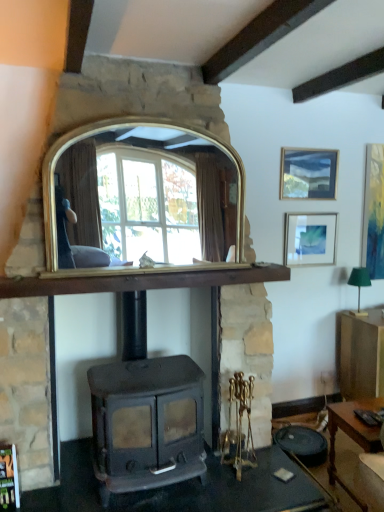
Identify the location of matte gold picture frame at right, the third picture frame when ordered from left to right. The height and width of the screenshot is (512, 384). (374, 212).

The height and width of the screenshot is (512, 384). What are the coordinates of `matte silver picture frame at upper right, which is the 2th picture frame in left-to-right order` in the screenshot? It's located at (310, 239).

This screenshot has width=384, height=512. What do you see at coordinates (359, 286) in the screenshot?
I see `green fabric lampshade at right` at bounding box center [359, 286].

Identify the location of matte wooden picture frame at upper right, placed as the first picture frame when sorted from left to right. (308, 173).

Image resolution: width=384 pixels, height=512 pixels. What do you see at coordinates (351, 435) in the screenshot? I see `wooden desk at lower right` at bounding box center [351, 435].

Based on the photo, in order to face wooden mantel at center, should I rotate leftwards or rightwards?

Turn left by 6.406 degrees to look at wooden mantel at center.

Measure the distance between wooden mantel at center and camera.

2.03 meters.

Where is `matte gold picture frame at right, arranged as the 1th picture frame when viewed from the right`? The height and width of the screenshot is (512, 384). matte gold picture frame at right, arranged as the 1th picture frame when viewed from the right is located at coordinates (374, 212).

You are a GUI agent. You are given a task and a screenshot of the screen. Output one action in this format:
    pyautogui.click(x=<x>, y=<y>)
    Task: Click on the 2nd picture frame behind the gold/glass mirror at center, starting your count from the anchor
    
    Given the screenshot: What is the action you would take?
    pyautogui.click(x=310, y=239)

In terms of width, does gold/glass mirror at center look wider or thinner when compared to matte silver picture frame at upper right, which is the 2th picture frame in left-to-right order?

gold/glass mirror at center is wider than matte silver picture frame at upper right, which is the 2th picture frame in left-to-right order.

Is gold/glass mirror at center placed right next to matte silver picture frame at upper right, which is the 2th picture frame in left-to-right order?

No, gold/glass mirror at center is not next to matte silver picture frame at upper right, which is the 2th picture frame in left-to-right order.

Can you confirm if gold/glass mirror at center is taller than matte silver picture frame at upper right, arranged as the second picture frame when viewed from the right?

Indeed, gold/glass mirror at center has a greater height compared to matte silver picture frame at upper right, arranged as the second picture frame when viewed from the right.

Is matte black wood burning stove at center thinner than wooden desk at lower right?

In fact, matte black wood burning stove at center might be wider than wooden desk at lower right.

Does matte black wood burning stove at center touch wooden desk at lower right?

matte black wood burning stove at center and wooden desk at lower right are clearly separated.

I want to click on desk behind the matte black wood burning stove at center, so click(x=351, y=435).

Choose the correct answer: Is matte black wood burning stove at center inside wooden desk at lower right or outside it?

matte black wood burning stove at center is not enclosed by wooden desk at lower right.

Which is behind, matte black wood burning stove at center or wooden mantel at center?

wooden mantel at center.

How much distance is there between matte black wood burning stove at center and wooden mantel at center?

A distance of 23.73 inches exists between matte black wood burning stove at center and wooden mantel at center.

Can you see matte black wood burning stove at center touching wooden mantel at center?

matte black wood burning stove at center and wooden mantel at center are clearly separated.

Between green fabric lampshade at right and matte silver picture frame at upper right, which is the 2th picture frame in left-to-right order, which one appears on the right side from the viewer's perspective?

From the viewer's perspective, green fabric lampshade at right appears more on the right side.

In terms of width, does green fabric lampshade at right look wider or thinner when compared to matte silver picture frame at upper right, which is the 2th picture frame in left-to-right order?

In the image, green fabric lampshade at right appears to be wider than matte silver picture frame at upper right, which is the 2th picture frame in left-to-right order.

How different are the orientations of green fabric lampshade at right and matte silver picture frame at upper right, arranged as the second picture frame when viewed from the right, in degrees?

0.91 degrees separate the facing orientations of green fabric lampshade at right and matte silver picture frame at upper right, arranged as the second picture frame when viewed from the right.

Is point (357, 311) less distant than point (302, 236)?

No, it is behind (302, 236).

Is wooden mantel at center wider than matte wooden picture frame at upper right, which appears as the third picture frame when viewed from the right?

Correct, the width of wooden mantel at center exceeds that of matte wooden picture frame at upper right, which appears as the third picture frame when viewed from the right.

Is wooden mantel at center not inside matte wooden picture frame at upper right, which appears as the third picture frame when viewed from the right?

Yes, wooden mantel at center is outside of matte wooden picture frame at upper right, which appears as the third picture frame when viewed from the right.

From a real-world perspective, is wooden mantel at center below matte wooden picture frame at upper right, which appears as the third picture frame when viewed from the right?

Indeed, from a real-world perspective, wooden mantel at center is positioned beneath matte wooden picture frame at upper right, which appears as the third picture frame when viewed from the right.

Is wooden mantel at center oriented towards gold/glass mirror at center?

No, wooden mantel at center is not oriented towards gold/glass mirror at center.

In the scene shown: How different are the orientations of wooden mantel at center and gold/glass mirror at center in degrees?

The angle between the facing direction of wooden mantel at center and the facing direction of gold/glass mirror at center is 0.764 degrees.

Between wooden mantel at center and gold/glass mirror at center, which one is positioned in front?

wooden mantel at center.

From the image's perspective, which one is positioned higher, wooden mantel at center or gold/glass mirror at center?

gold/glass mirror at center is shown above in the image.

Who is bigger, matte wooden picture frame at upper right, which appears as the third picture frame when viewed from the right, or matte black wood burning stove at center?

matte black wood burning stove at center.

Considering the sizes of objects matte wooden picture frame at upper right, placed as the first picture frame when sorted from left to right, and matte black wood burning stove at center in the image provided, who is taller, matte wooden picture frame at upper right, placed as the first picture frame when sorted from left to right, or matte black wood burning stove at center?

matte black wood burning stove at center is taller.

From the image's perspective, is matte wooden picture frame at upper right, placed as the first picture frame when sorted from left to right, located above or below matte black wood burning stove at center?

Clearly, from the image's perspective, matte wooden picture frame at upper right, placed as the first picture frame when sorted from left to right, is above matte black wood burning stove at center.

The width and height of the screenshot is (384, 512). What are the coordinates of `picture frame that is the 2nd object located behind the gold/glass mirror at center` in the screenshot? It's located at (310, 239).

Find the location of a particular element. The width and height of the screenshot is (384, 512). desk that is on the right side of matte black wood burning stove at center is located at coordinates (351, 435).

Based on their spatial positions, is matte wooden picture frame at upper right, which appears as the third picture frame when viewed from the right, or gold/glass mirror at center further from matte gold picture frame at right, arranged as the 1th picture frame when viewed from the right?

Among the two, gold/glass mirror at center is located further to matte gold picture frame at right, arranged as the 1th picture frame when viewed from the right.

Which object lies nearer to the anchor point wooden desk at lower right, matte black wood burning stove at center or wooden mantel at center?

matte black wood burning stove at center.

From the image, which object appears to be farther from matte gold picture frame at right, the third picture frame when ordered from left to right, wooden desk at lower right or green fabric lampshade at right?

Based on the image, wooden desk at lower right appears to be further to matte gold picture frame at right, the third picture frame when ordered from left to right.

Estimate the real-world distances between objects in this image. Which object is closer to matte gold picture frame at right, the third picture frame when ordered from left to right, wooden desk at lower right or matte silver picture frame at upper right, which is the 2th picture frame in left-to-right order?

Based on the image, matte silver picture frame at upper right, which is the 2th picture frame in left-to-right order, appears to be nearer to matte gold picture frame at right, the third picture frame when ordered from left to right.

When comparing their distances from matte silver picture frame at upper right, which is the 2th picture frame in left-to-right order, does matte gold picture frame at right, arranged as the 1th picture frame when viewed from the right, or gold/glass mirror at center seem closer?

matte gold picture frame at right, arranged as the 1th picture frame when viewed from the right.

Considering their positions, is matte wooden picture frame at upper right, which appears as the third picture frame when viewed from the right, positioned further to matte silver picture frame at upper right, arranged as the second picture frame when viewed from the right, than wooden desk at lower right?

wooden desk at lower right.

Looking at the image, which one is located further to wooden desk at lower right, matte black wood burning stove at center or matte wooden picture frame at upper right, placed as the first picture frame when sorted from left to right?

Among the two, matte wooden picture frame at upper right, placed as the first picture frame when sorted from left to right, is located further to wooden desk at lower right.

Looking at the image, which one is located closer to matte gold picture frame at right, arranged as the 1th picture frame when viewed from the right, gold/glass mirror at center or wooden mantel at center?

The object closer to matte gold picture frame at right, arranged as the 1th picture frame when viewed from the right, is wooden mantel at center.

Find the location of `lamp between matte wooden picture frame at upper right, placed as the first picture frame when sorted from left to right, and wooden desk at lower right vertically`. lamp between matte wooden picture frame at upper right, placed as the first picture frame when sorted from left to right, and wooden desk at lower right vertically is located at coordinates (359, 286).

The height and width of the screenshot is (512, 384). I want to click on lamp between wooden mantel at center and matte gold picture frame at right, arranged as the 1th picture frame when viewed from the right, so click(x=359, y=286).

Where is `picture frame situated between wooden mantel at center and matte silver picture frame at upper right, arranged as the second picture frame when viewed from the right, from left to right`? This screenshot has width=384, height=512. picture frame situated between wooden mantel at center and matte silver picture frame at upper right, arranged as the second picture frame when viewed from the right, from left to right is located at coordinates (308, 173).

At what (x,y) coordinates should I click in order to perform the action: click on mirror between matte black wood burning stove at center and wooden desk at lower right. Please return your answer as a coordinate pair (x, y). The height and width of the screenshot is (512, 384). Looking at the image, I should click on (145, 195).